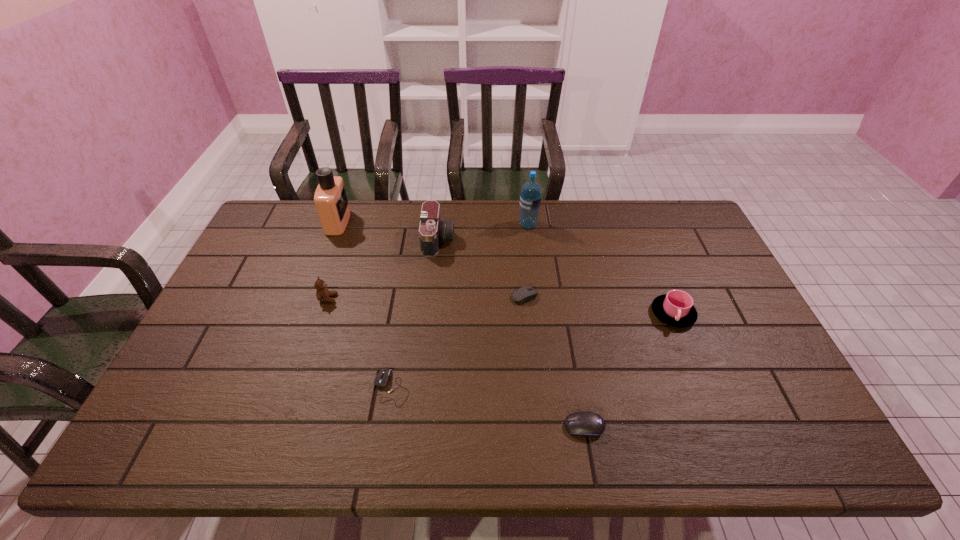
Locate an element on the screen. unoccupied position between the cup and the rightmost computer mouse is located at coordinates (629, 370).

Locate an element on the screen. free spot between the water bottle and the fourth tallest object is located at coordinates (428, 261).

The height and width of the screenshot is (540, 960). In order to click on unoccupied area between the fourth tallest object and the perfume in this screenshot , I will do [333, 260].

Where is `vacant point located between the cup and the perfume`? This screenshot has height=540, width=960. vacant point located between the cup and the perfume is located at coordinates (505, 268).

Where is `unoccupied position between the cup and the nearest computer mouse`? Image resolution: width=960 pixels, height=540 pixels. unoccupied position between the cup and the nearest computer mouse is located at coordinates (629, 370).

This screenshot has width=960, height=540. In order to click on vacant region between the farthest computer mouse and the sixth shortest object in this screenshot , I will do `click(481, 268)`.

In order to click on free space between the teddy bear and the perfume in this screenshot , I will do `click(333, 260)`.

Locate an element on the screen. The width and height of the screenshot is (960, 540). free space between the water bottle and the fourth tallest object is located at coordinates (x=428, y=261).

Find the location of a particular element. The height and width of the screenshot is (540, 960). object identified as the closest to the rightmost computer mouse is located at coordinates (675, 308).

At what (x,y) coordinates should I click in order to perform the action: click on object that is the fifth nearest to the rightmost object. Please return your answer as a coordinate pair (x, y). The width and height of the screenshot is (960, 540). Looking at the image, I should click on (382, 378).